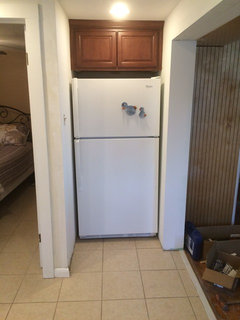
The width and height of the screenshot is (240, 320). I want to click on box, so click(x=218, y=278), click(x=204, y=251).